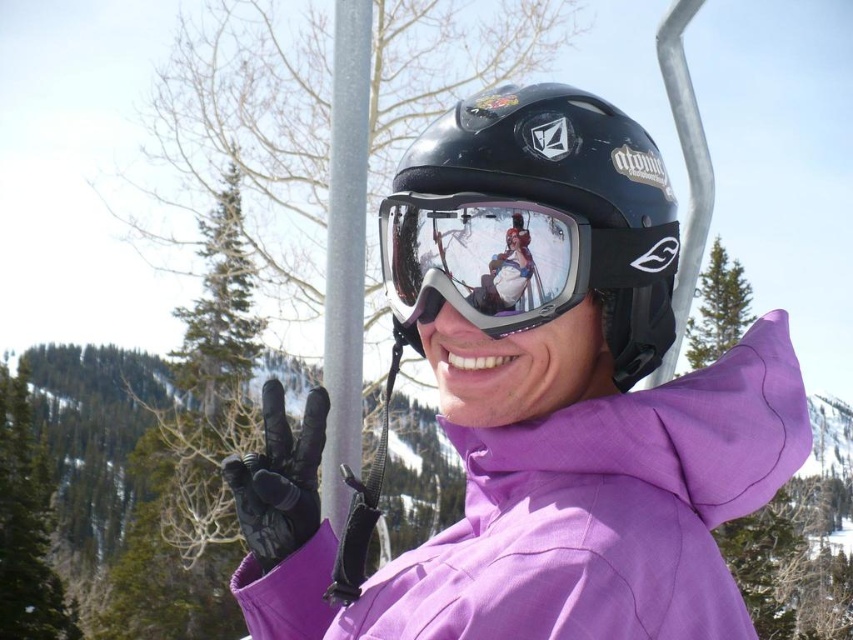
You are trying to locate a specific point in the image. The point is at coordinates point [534,221]. According to the scene description, where would this point be located?

The point [534,221] is on the black matte helmet at center.